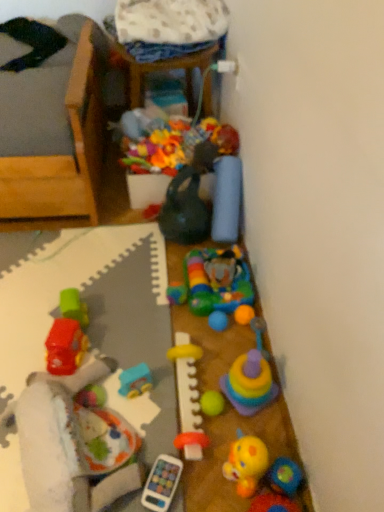
I want to click on unoccupied area behind blue plastic toy car at center, positioned as the tenth toy in right-to-left order, so click(146, 335).